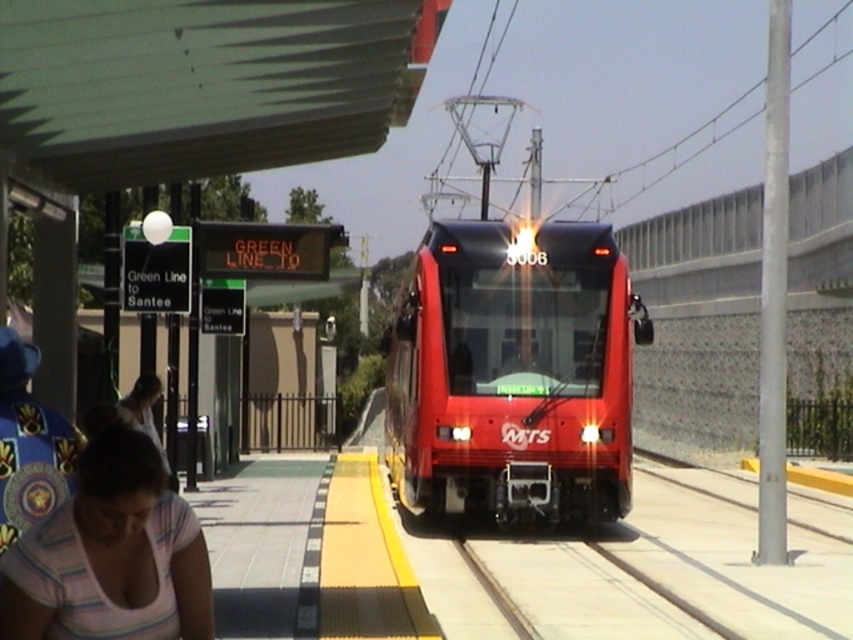
Question: Can you confirm if shiny red train at center is wider than pink striped shirt at lower left?

Choices:
 (A) yes
 (B) no

Answer: (A)

Question: Does shiny red train at center have a greater width compared to pink striped shirt at lower left?

Choices:
 (A) no
 (B) yes

Answer: (B)

Question: Which point is closer to the camera?

Choices:
 (A) (584, 424)
 (B) (676, 605)
 (C) (105, 497)

Answer: (C)

Question: Which of the following is the closest to the observer?

Choices:
 (A) metal train track at center
 (B) shiny red train at center
 (C) pink striped shirt at lower left

Answer: (C)

Question: Is shiny red train at center positioned behind pink striped shirt at lower left?

Choices:
 (A) yes
 (B) no

Answer: (A)

Question: Which is farther from the shiny red train at center?

Choices:
 (A) metal train track at center
 (B) pink striped shirt at lower left

Answer: (B)